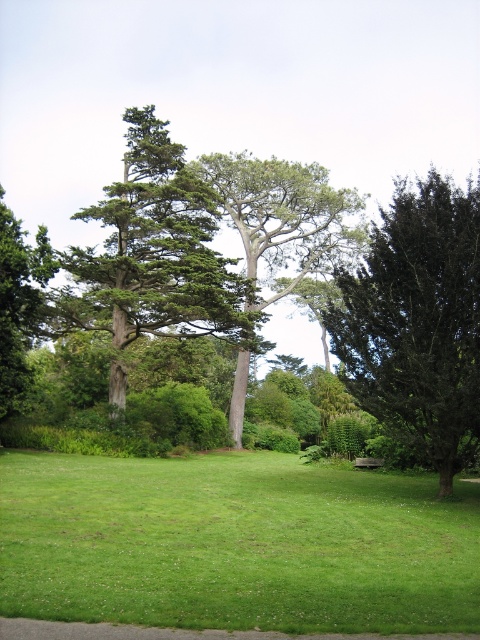
Is green textured tree at center bigger than green leafy tree at center?

Incorrect, green textured tree at center is not larger than green leafy tree at center.

Is point (113, 337) positioned before point (264, 161)?

That is True.

Find the location of a particular element. green textured tree at center is located at coordinates (152, 257).

Between dark green textured tree at right and green leafy tree at center, which one has less height?

With less height is dark green textured tree at right.

Which of these two, dark green textured tree at right or green leafy tree at center, stands taller?

With more height is green leafy tree at center.

Who is more forward, (447,280) or (272,269)?

Positioned in front is point (447,280).

Where is `dark green textured tree at right`? The image size is (480, 640). dark green textured tree at right is located at coordinates (418, 323).

Does green grass at center lie behind dark green textured tree at right?

No, green grass at center is closer to the viewer.

Where is `green grass at center`? The width and height of the screenshot is (480, 640). green grass at center is located at coordinates (236, 545).

The width and height of the screenshot is (480, 640). Identify the location of green grass at center. (x=236, y=545).